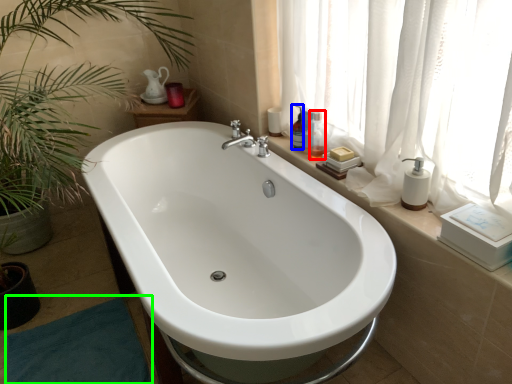
Question: Which is farther away from toiletry (highlighted by a red box)? toiletry (highlighted by a blue box) or bath mat (highlighted by a green box)?

Choices:
 (A) toiletry
 (B) bath mat

Answer: (B)